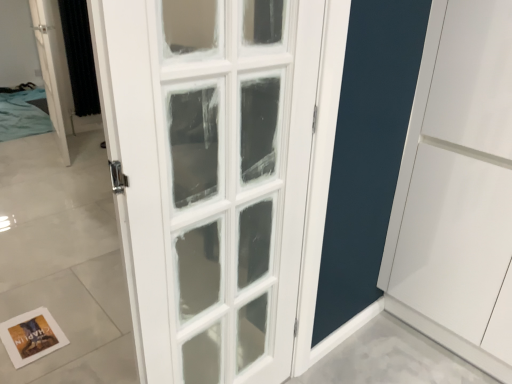
Question: In the image, is white glass door at upper left positioned in front of or behind black textured curtain at left?

Choices:
 (A) behind
 (B) front

Answer: (B)

Question: From a real-world perspective, is white glass door at upper left above or below black textured curtain at left?

Choices:
 (A) above
 (B) below

Answer: (B)

Question: Which of these objects is positioned farthest from the white paper postcard at lower left?

Choices:
 (A) black textured curtain at left
 (B) white glass door at upper left

Answer: (A)

Question: Which object is positioned closest to the white glass door at upper left?

Choices:
 (A) white paper postcard at lower left
 (B) black textured curtain at left

Answer: (B)